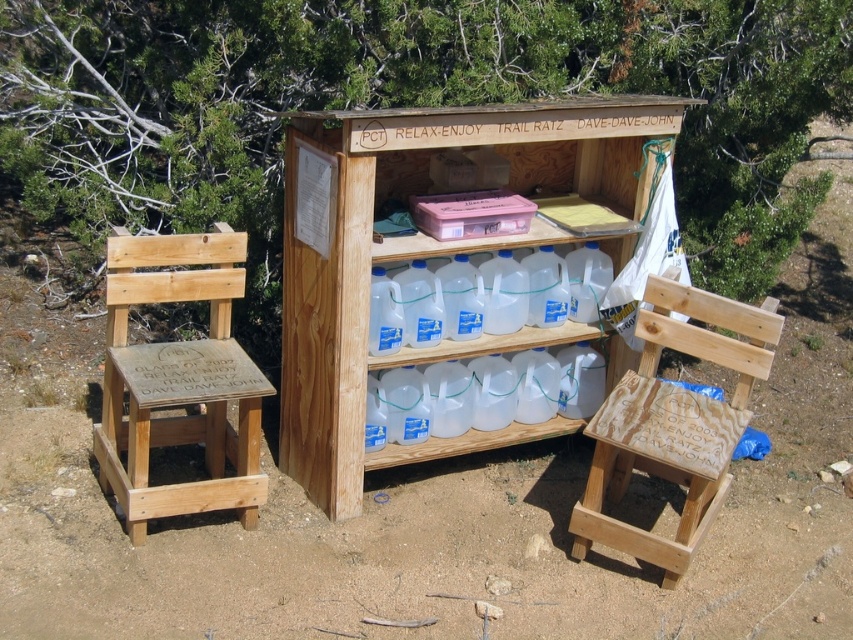
Question: Which point is farther to the camera?

Choices:
 (A) wooden at center
 (B) natural wood step stool at left
 (C) wooden step stool at lower right

Answer: (A)

Question: Does wooden at center appear over wooden step stool at lower right?

Choices:
 (A) yes
 (B) no

Answer: (A)

Question: Which of these objects is positioned farthest from the natural wood step stool at left?

Choices:
 (A) wooden at center
 (B) wooden step stool at lower right

Answer: (B)

Question: Considering the real-world distances, which object is closest to the natural wood step stool at left?

Choices:
 (A) wooden step stool at lower right
 (B) wooden at center

Answer: (B)

Question: Does wooden at center have a smaller size compared to natural wood step stool at left?

Choices:
 (A) yes
 (B) no

Answer: (B)

Question: Considering the relative positions of natural wood step stool at left and wooden step stool at lower right in the image provided, where is natural wood step stool at left located with respect to wooden step stool at lower right?

Choices:
 (A) right
 (B) left

Answer: (B)